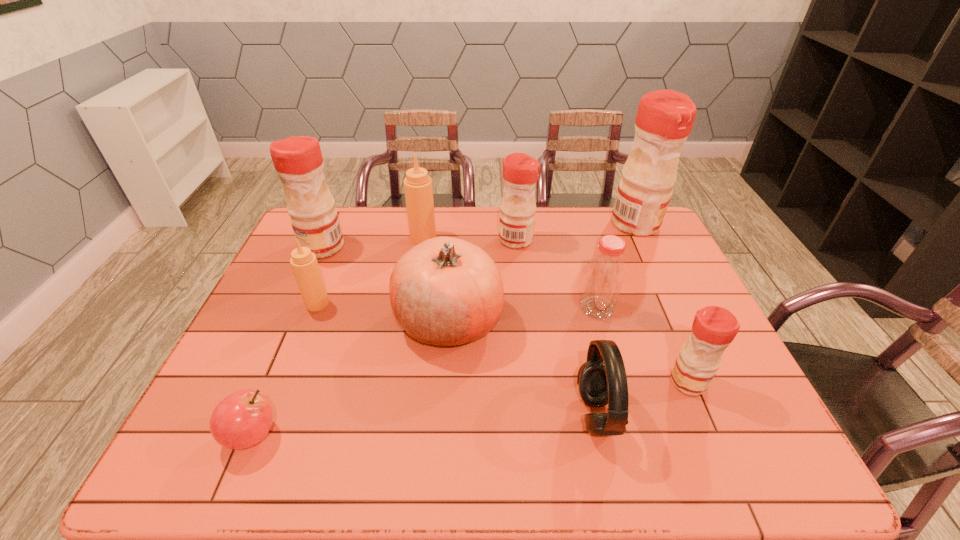
At what (x,y) coordinates should I click in order to perform the action: click on free point located 0.370m on the right of the fourth condiment from left to right. Please return your answer as a coordinate pair (x, y). This screenshot has width=960, height=540. Looking at the image, I should click on (644, 240).

Find the location of a particular element. vacant region located 0.380m on the left of the pumpkin is located at coordinates [x=255, y=319].

Identify the location of vacant space located 0.090m on the right of the bottle. This screenshot has height=540, width=960. point(647,308).

Locate an element on the screen. This screenshot has height=540, width=960. free region located 0.170m on the right of the fifth farthest condiment is located at coordinates (389, 303).

This screenshot has height=540, width=960. I want to click on free space located on the back of the smallest red condiment, so click(638, 266).

This screenshot has height=540, width=960. I want to click on free spot located on the earcups of the headset, so click(x=547, y=414).

Where is `free point located on the earcups of the headset`? The width and height of the screenshot is (960, 540). free point located on the earcups of the headset is located at coordinates (516, 414).

Locate an element on the screen. The width and height of the screenshot is (960, 540). vacant region located on the earcups of the headset is located at coordinates (426, 414).

This screenshot has height=540, width=960. In order to click on free region located 0.160m on the back of the shortest object in this screenshot , I will do `click(285, 355)`.

Identify the location of headset present at the near edge. (602, 380).